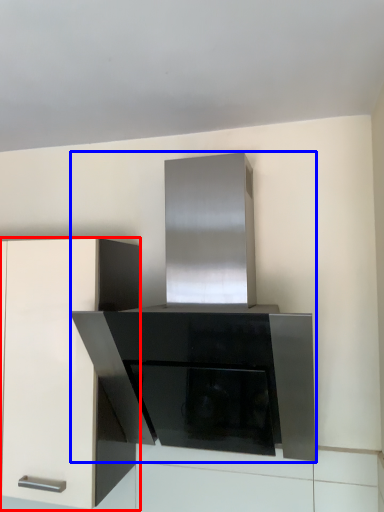
Question: Among these objects, which one is nearest to the camera, cabinetry (highlighted by a red box) or appliance (highlighted by a blue box)?

Choices:
 (A) cabinetry
 (B) appliance

Answer: (B)